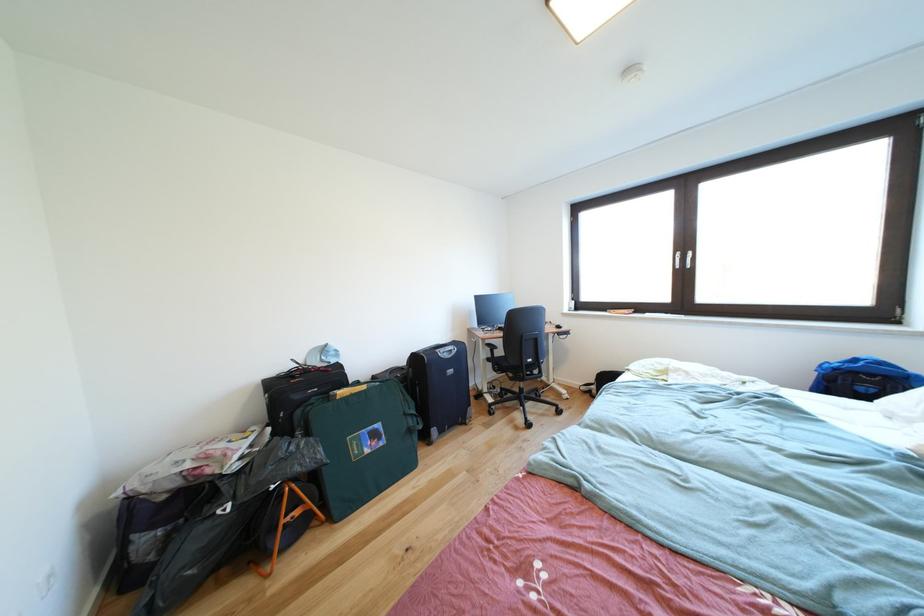
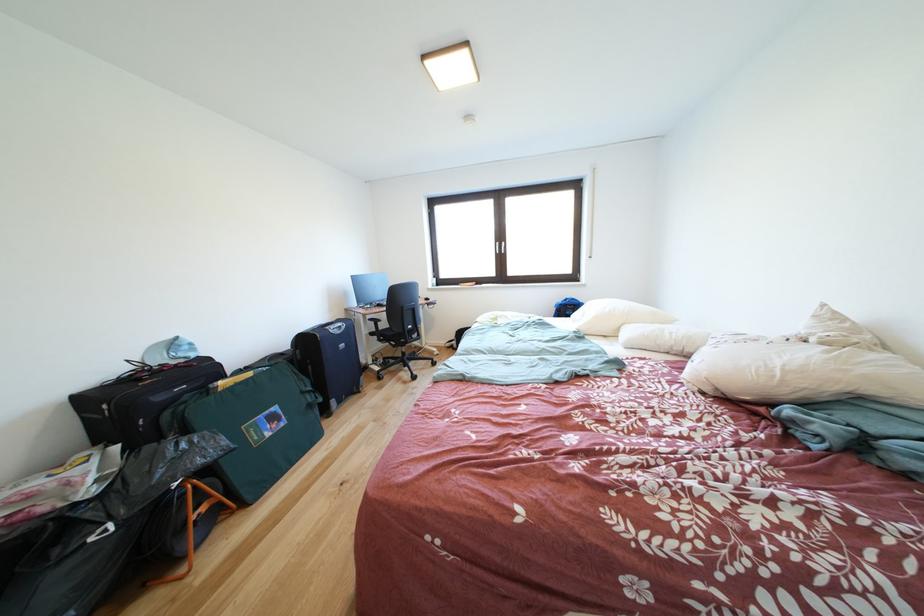
Find the pixel in the second image that matches (x=456, y=361) in the first image.

(347, 337)